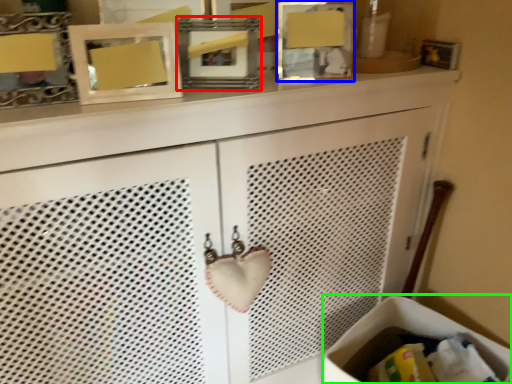
Question: Which object is positioned closest to picture frame (highlighted by a red box)? Select from picture frame (highlighted by a blue box) and laundry basket (highlighted by a green box).

Choices:
 (A) picture frame
 (B) laundry basket

Answer: (A)